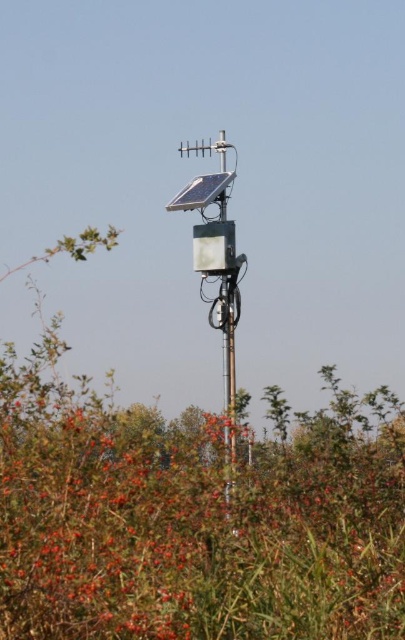
What do you see at coordinates (193, 516) in the screenshot? The image size is (405, 640). I see `green leafy bush at center` at bounding box center [193, 516].

Is point (68, 500) closer to camera compared to point (206, 275)?

Yes, it is in front of point (206, 275).

This screenshot has height=640, width=405. What are the coordinates of `green leafy bush at center` in the screenshot? It's located at (193, 516).

Is metallic solar panel at center smaller than metallic pole at center?

No, metallic solar panel at center is not smaller than metallic pole at center.

Is metallic solar panel at center below metallic pole at center?

Actually, metallic solar panel at center is above metallic pole at center.

Between point (208, 186) and point (230, 332), which one is positioned in front?

Point (230, 332)

In order to click on metallic solar panel at center in this screenshot , I will do `click(217, 269)`.

Is green leafy bush at center shorter than metallic pole at center?

Incorrect, green leafy bush at center's height does not fall short of metallic pole at center's.

Can you confirm if green leafy bush at center is positioned above metallic pole at center?

Actually, green leafy bush at center is below metallic pole at center.

This screenshot has height=640, width=405. I want to click on green leafy bush at center, so click(x=193, y=516).